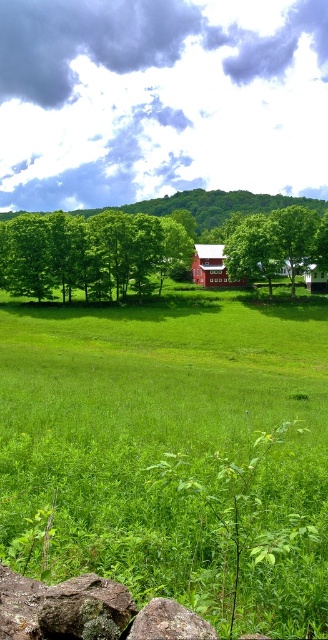
You are standing in the rural landscape scene. There are two points marked in the image. The first point is at coordinate point (75, 582) and the second point is at coordinate point (198, 250). Which point is closer to you?

Point (75, 582) is in front of point (198, 250), so it is closer to you.